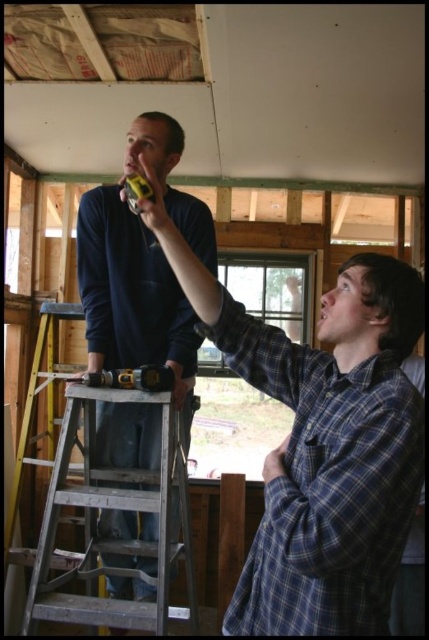
Question: Which of these objects is positioned farthest from the silver metallic ladder at left?

Choices:
 (A) blue plaid shirt at upper center
 (B) dark blue shirt at upper left

Answer: (A)

Question: Is blue plaid shirt at upper center further to camera compared to yellow plastic drill at center?

Choices:
 (A) no
 (B) yes

Answer: (A)

Question: Is blue plaid shirt at upper center smaller than yellow plastic drill at center?

Choices:
 (A) yes
 (B) no

Answer: (B)

Question: Which point appears farthest from the camera in this image?

Choices:
 (A) (245, 621)
 (B) (148, 368)
 (C) (145, 529)
 (D) (78, 600)

Answer: (C)

Question: Is blue plaid shirt at upper center above yellow plastic drill at center?

Choices:
 (A) no
 (B) yes

Answer: (B)

Question: Which is farther from the dark blue shirt at upper left?

Choices:
 (A) yellow plastic drill at center
 (B) blue plaid shirt at upper center

Answer: (B)